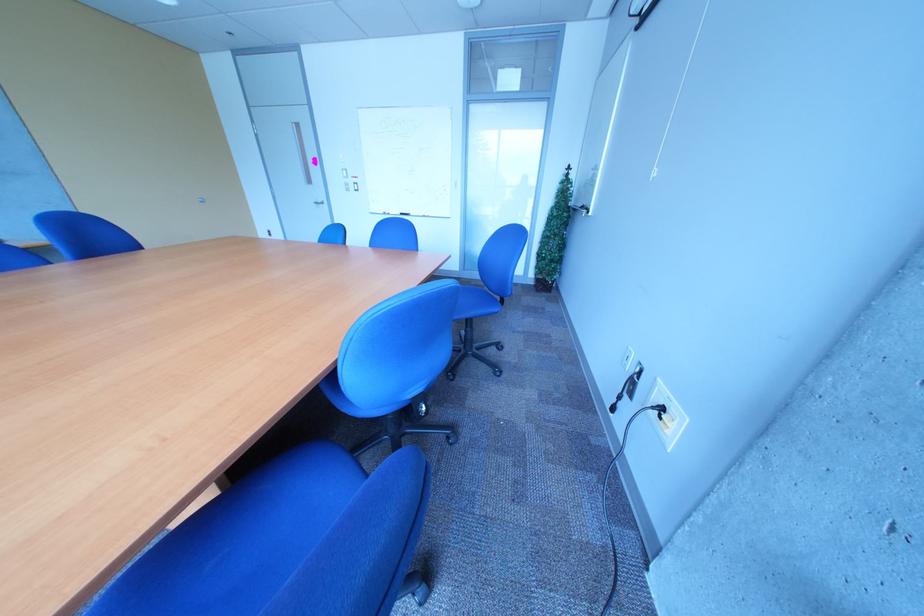
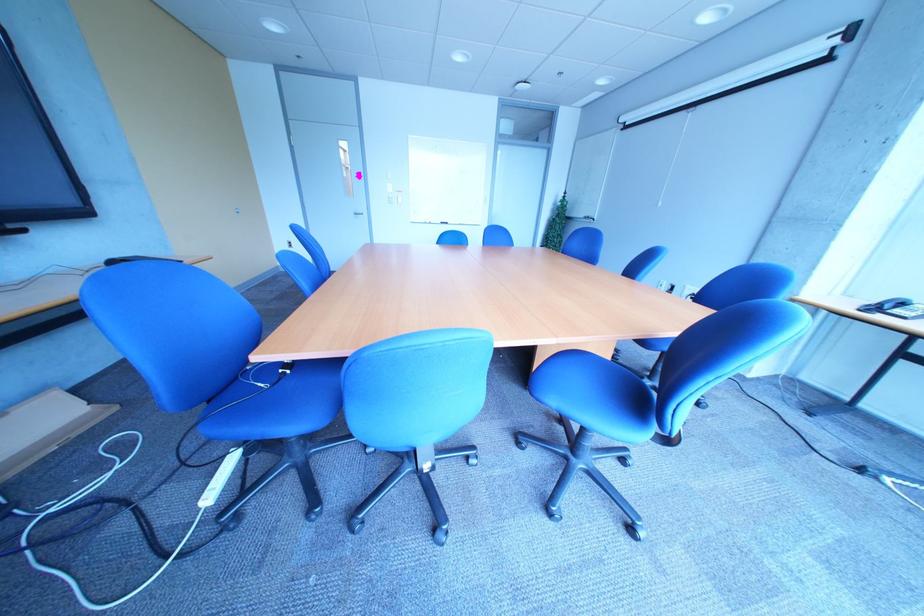
Question: What movement of the cameraman would produce the second image?

Choices:
 (A) Left
 (B) Right
 (C) Forward
 (D) Backward

Answer: (A)